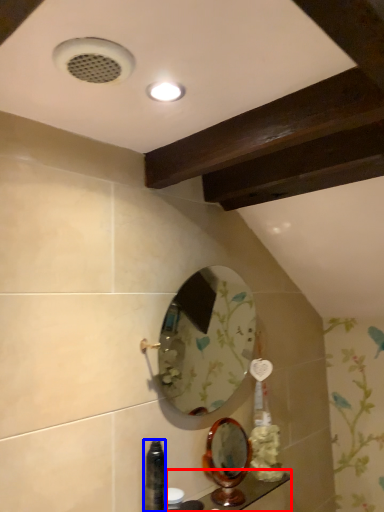
Question: Among these objects, which one is nearest to the camera, counter top (highlighted by a red box) or bottle (highlighted by a blue box)?

Choices:
 (A) counter top
 (B) bottle

Answer: (B)